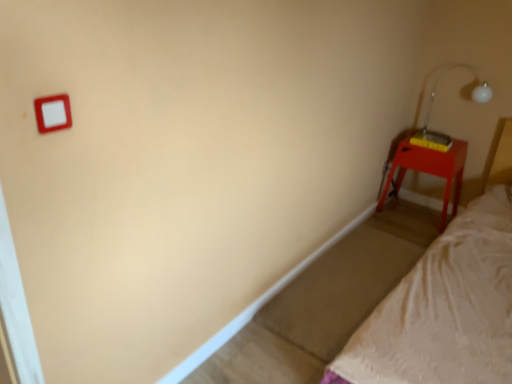
At what (x,y) coordinates should I click in order to perform the action: click on matte red nightstand at right. Please return your answer as a coordinate pair (x, y). The width and height of the screenshot is (512, 384). Looking at the image, I should click on (429, 170).

What is the approximate height of matte red nightstand at right?

matte red nightstand at right is 21.17 inches tall.

This screenshot has height=384, width=512. Describe the element at coordinates (429, 170) in the screenshot. I see `matte red nightstand at right` at that location.

Image resolution: width=512 pixels, height=384 pixels. Find the location of `transparent plastic lamp at upper right`. transparent plastic lamp at upper right is located at coordinates (432, 106).

Describe the element at coordinates (432, 106) in the screenshot. I see `transparent plastic lamp at upper right` at that location.

Measure the distance between transparent plastic lamp at upper right and camera.

A distance of 9.10 feet exists between transparent plastic lamp at upper right and camera.

This screenshot has height=384, width=512. What are the coordinates of `matte red nightstand at right` in the screenshot? It's located at (429, 170).

Can you confirm if matte red nightstand at right is positioned to the right of transparent plastic lamp at upper right?

Incorrect, matte red nightstand at right is not on the right side of transparent plastic lamp at upper right.

Which object is more forward, matte red nightstand at right or transparent plastic lamp at upper right?

transparent plastic lamp at upper right is closer to the camera.

Is point (442, 153) farther from camera compared to point (416, 132)?

No, it is in front of (416, 132).

From the image's perspective, is matte red nightstand at right below transparent plastic lamp at upper right?

Yes, from the image's perspective, matte red nightstand at right is beneath transparent plastic lamp at upper right.

From a real-world perspective, does matte red nightstand at right stand above transparent plastic lamp at upper right?

Actually, matte red nightstand at right is physically below transparent plastic lamp at upper right in the real world.

Considering the sizes of matte red nightstand at right and transparent plastic lamp at upper right in the image, is matte red nightstand at right wider or thinner than transparent plastic lamp at upper right?

In the image, matte red nightstand at right appears to be wider than transparent plastic lamp at upper right.

Considering the sizes of matte red nightstand at right and transparent plastic lamp at upper right in the image, is matte red nightstand at right taller or shorter than transparent plastic lamp at upper right?

matte red nightstand at right is taller than transparent plastic lamp at upper right.

Between matte red nightstand at right and transparent plastic lamp at upper right, which one has smaller size?

transparent plastic lamp at upper right.

Is matte red nightstand at right situated inside transparent plastic lamp at upper right or outside?

The correct answer is: outside.

Would you say matte red nightstand at right is a long distance from transparent plastic lamp at upper right?

That's not correct — matte red nightstand at right is a little close to transparent plastic lamp at upper right.

Is matte red nightstand at right facing away from transparent plastic lamp at upper right?

matte red nightstand at right is not turned away from transparent plastic lamp at upper right.

Measure the distance from matte red nightstand at right to transparent plastic lamp at upper right.

matte red nightstand at right and transparent plastic lamp at upper right are 8.81 inches apart.

Where is `nightstand beneath the transparent plastic lamp at upper right (from a real-world perspective)`? This screenshot has width=512, height=384. nightstand beneath the transparent plastic lamp at upper right (from a real-world perspective) is located at coordinates coord(429,170).

Which object is positioned more to the right, transparent plastic lamp at upper right or matte red nightstand at right?

From the viewer's perspective, transparent plastic lamp at upper right appears more on the right side.

Considering the relative positions of transparent plastic lamp at upper right and matte red nightstand at right in the image provided, is transparent plastic lamp at upper right behind matte red nightstand at right?

No, it is in front of matte red nightstand at right.

Is point (431, 106) closer to camera compared to point (406, 158)?

No, (431, 106) is further to viewer.

From the image's perspective, is transparent plastic lamp at upper right located above matte red nightstand at right?

Yes, from the image's perspective, transparent plastic lamp at upper right is above matte red nightstand at right.

From a real-world perspective, is transparent plastic lamp at upper right positioned under matte red nightstand at right based on gravity?

No.

Which of these two, transparent plastic lamp at upper right or matte red nightstand at right, is thinner?

With smaller width is transparent plastic lamp at upper right.

Can you confirm if transparent plastic lamp at upper right is shorter than matte red nightstand at right?

Indeed, transparent plastic lamp at upper right has a lesser height compared to matte red nightstand at right.

Considering the sizes of objects transparent plastic lamp at upper right and matte red nightstand at right in the image provided, who is smaller, transparent plastic lamp at upper right or matte red nightstand at right?

transparent plastic lamp at upper right.

Would you say matte red nightstand at right is part of transparent plastic lamp at upper right's contents?

No, matte red nightstand at right is not surrounded by transparent plastic lamp at upper right.

Looking at this image, would you say transparent plastic lamp at upper right is a long distance from matte red nightstand at right?

No, there isn't a large distance between transparent plastic lamp at upper right and matte red nightstand at right.

Is transparent plastic lamp at upper right facing towards matte red nightstand at right?

No, transparent plastic lamp at upper right is not facing towards matte red nightstand at right.

Where is `nightstand lying below the transparent plastic lamp at upper right (from the image's perspective)`? The width and height of the screenshot is (512, 384). nightstand lying below the transparent plastic lamp at upper right (from the image's perspective) is located at coordinates (429, 170).

You are a GUI agent. You are given a task and a screenshot of the screen. Output one action in this format:
    pyautogui.click(x=<x>, y=<y>)
    Task: Click on the lamp in front of the matte red nightstand at right
    This screenshot has width=512, height=384.
    Given the screenshot: What is the action you would take?
    pyautogui.click(x=432, y=106)

The width and height of the screenshot is (512, 384). I want to click on lamp on the right of the matte red nightstand at right, so click(x=432, y=106).